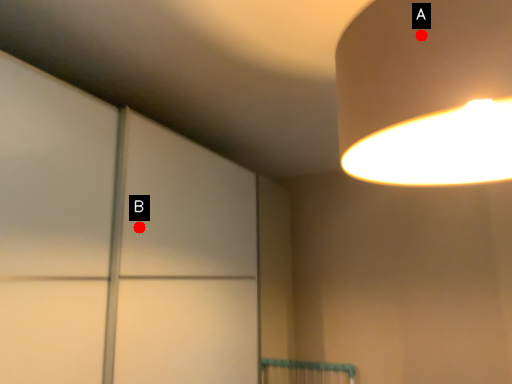
Question: Two points are circled on the image, labeled by A and B beside each circle. Which of the following is the closest to the observer?

Choices:
 (A) A is closer
 (B) B is closer

Answer: (A)